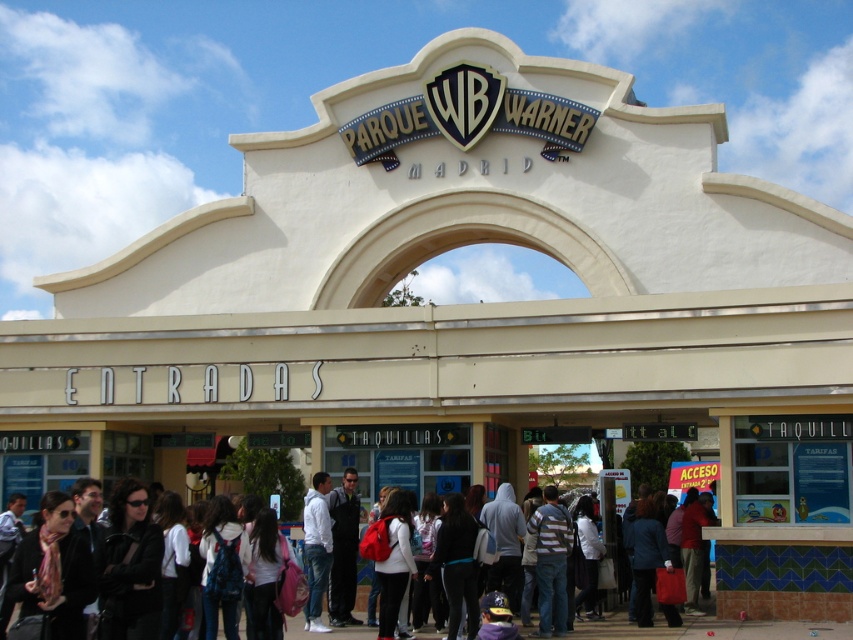
Is white matte jacket at center below white cotton shirt at center?

Incorrect, white matte jacket at center is not positioned below white cotton shirt at center.

Who is higher up, white matte jacket at center or white cotton shirt at center?

white matte jacket at center is higher up.

This screenshot has height=640, width=853. In order to click on white matte jacket at center in this screenshot , I will do `click(316, 548)`.

Who is higher up, striped shirt at center or white cotton shirt at center?

striped shirt at center

What do you see at coordinates (550, 561) in the screenshot? This screenshot has height=640, width=853. I see `striped shirt at center` at bounding box center [550, 561].

You are a GUI agent. You are given a task and a screenshot of the screen. Output one action in this format:
    pyautogui.click(x=<x>, y=<y>)
    Task: Click on the striped shirt at center
    
    Given the screenshot: What is the action you would take?
    pyautogui.click(x=550, y=561)

Is dark gray fabric jacket at center closer to camera compared to white matte jacket at center?

No, dark gray fabric jacket at center is further to the viewer.

Does point (335, 560) lie behind point (312, 611)?

That is True.

You are a GUI agent. You are given a task and a screenshot of the screen. Output one action in this format:
    pyautogui.click(x=<x>, y=<y>)
    Task: Click on the dark gray fabric jacket at center
    The width and height of the screenshot is (853, 640).
    Given the screenshot: What is the action you would take?
    pyautogui.click(x=343, y=548)